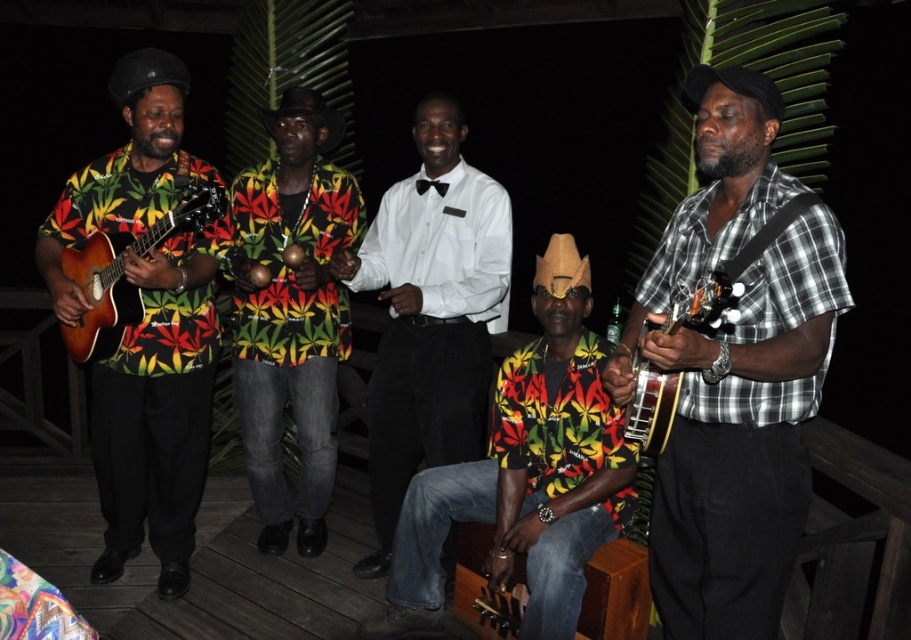
Can you confirm if plaid cotton shirt at right is bigger than matte brown banjo at right?

Yes, plaid cotton shirt at right is bigger than matte brown banjo at right.

Is plaid cotton shirt at right shorter than matte brown banjo at right?

In fact, plaid cotton shirt at right may be taller than matte brown banjo at right.

Is point (754, 84) closer to camera compared to point (663, 410)?

Yes, point (754, 84) is in front of point (663, 410).

Find the location of a particular element. This screenshot has height=640, width=911. plaid cotton shirt at right is located at coordinates (734, 372).

Based on the photo, is matte wood guitar at left positioned before matte brown banjo at right?

No, it is not.

Who is more forward, (x=179, y=227) or (x=693, y=308)?

Point (x=693, y=308)

Find the location of a particular element. matte wood guitar at left is located at coordinates (123, 269).

The image size is (911, 640). In order to click on matte wood guitar at left in this screenshot , I will do `click(123, 269)`.

In the scene shown: Can you confirm if matte black guitar at left is positioned to the left of matte wood guitar at left?

Correct, you'll find matte black guitar at left to the left of matte wood guitar at left.

What do you see at coordinates (157, 412) in the screenshot? The width and height of the screenshot is (911, 640). I see `matte black guitar at left` at bounding box center [157, 412].

This screenshot has height=640, width=911. I want to click on matte black guitar at left, so click(x=157, y=412).